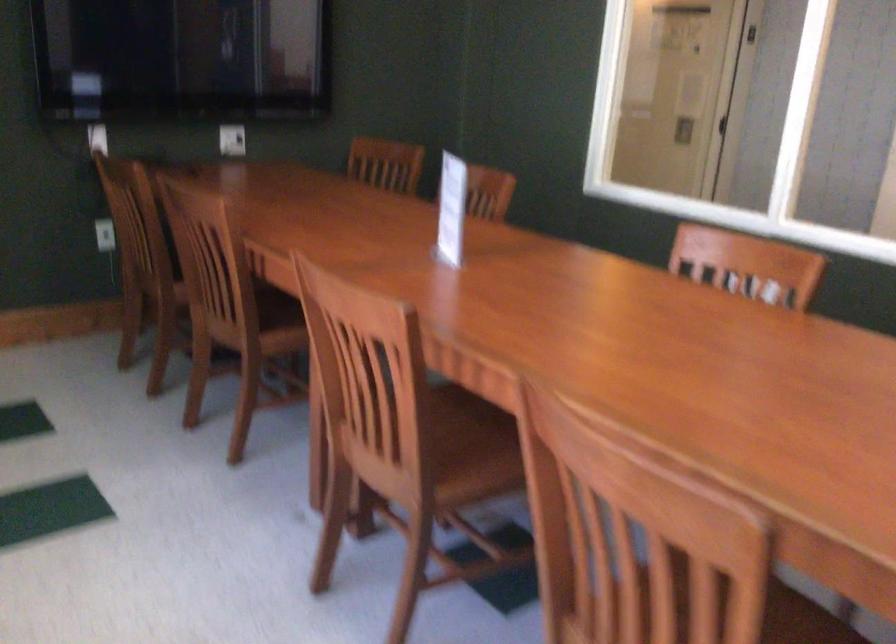
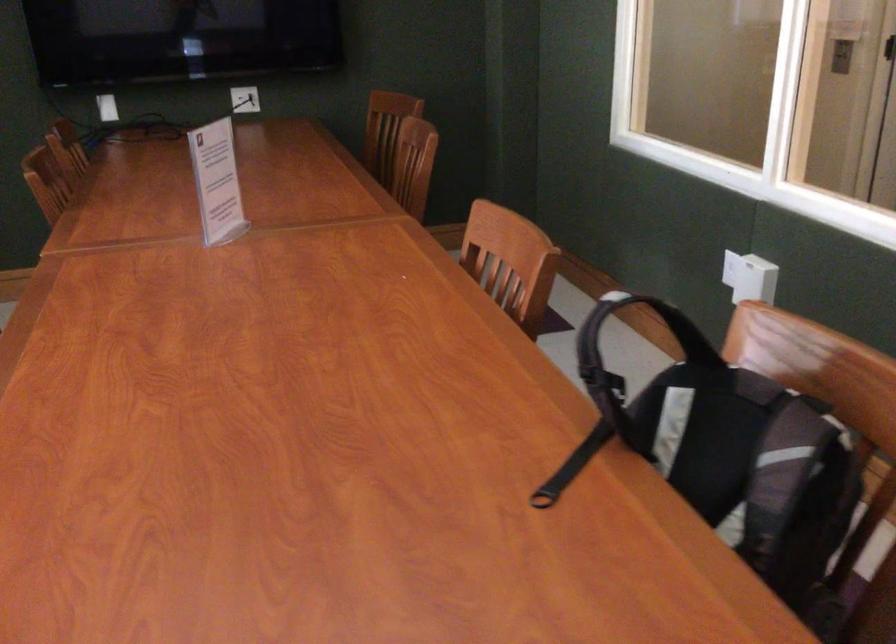
Find the pixel in the second image that matches (x=745, y=267) in the first image.

(510, 261)